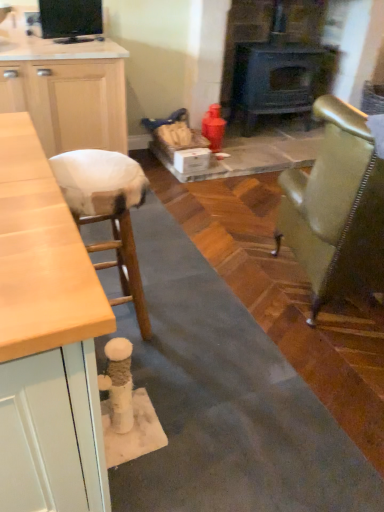
Question: Considering the relative sizes of metallic gold chair at right and dark gray cast iron wood burning stove at center in the image provided, is metallic gold chair at right thinner than dark gray cast iron wood burning stove at center?

Choices:
 (A) no
 (B) yes

Answer: (A)

Question: Does metallic gold chair at right turn towards dark gray cast iron wood burning stove at center?

Choices:
 (A) no
 (B) yes

Answer: (B)

Question: Can you confirm if metallic gold chair at right is wider than dark gray cast iron wood burning stove at center?

Choices:
 (A) no
 (B) yes

Answer: (B)

Question: Can you confirm if metallic gold chair at right is positioned to the left of dark gray cast iron wood burning stove at center?

Choices:
 (A) no
 (B) yes

Answer: (A)

Question: Does metallic gold chair at right have a lesser height compared to dark gray cast iron wood burning stove at center?

Choices:
 (A) no
 (B) yes

Answer: (B)

Question: Is dark gray cast iron wood burning stove at center located within metallic gold chair at right?

Choices:
 (A) yes
 (B) no

Answer: (B)

Question: Does black glossy tv at upper left have a lesser height compared to metallic gold chair at right?

Choices:
 (A) yes
 (B) no

Answer: (A)

Question: Could you tell me if black glossy tv at upper left is turned towards metallic gold chair at right?

Choices:
 (A) yes
 (B) no

Answer: (A)

Question: Is black glossy tv at upper left wider than metallic gold chair at right?

Choices:
 (A) no
 (B) yes

Answer: (A)

Question: Is metallic gold chair at right surrounded by black glossy tv at upper left?

Choices:
 (A) yes
 (B) no

Answer: (B)

Question: From a real-world perspective, is black glossy tv at upper left on top of metallic gold chair at right?

Choices:
 (A) yes
 (B) no

Answer: (A)

Question: Considering the relative sizes of black glossy tv at upper left and metallic gold chair at right in the image provided, is black glossy tv at upper left thinner than metallic gold chair at right?

Choices:
 (A) no
 (B) yes

Answer: (B)

Question: Can you confirm if dark gray cast iron wood burning stove at center is wider than metallic gold chair at right?

Choices:
 (A) no
 (B) yes

Answer: (A)